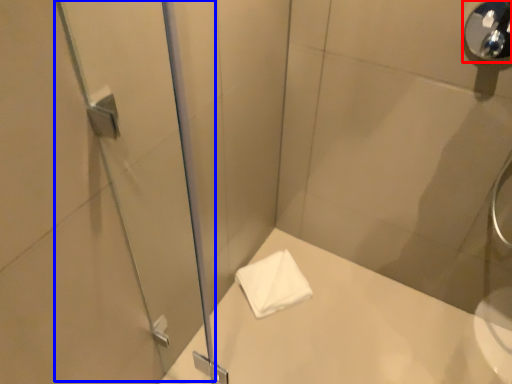
Question: Which of the following is the farthest to the observer, shower (highlighted by a red box) or screen door (highlighted by a blue box)?

Choices:
 (A) shower
 (B) screen door

Answer: (A)